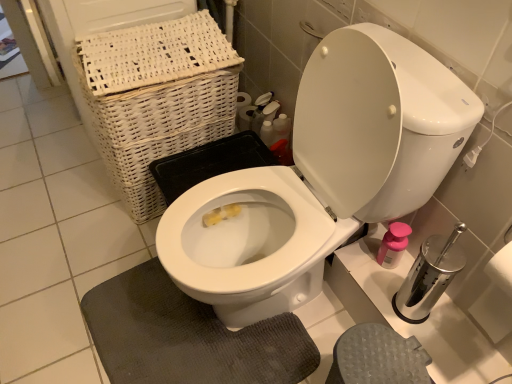
In order to face white wicker basket at upper left, should I rotate leftwards or rightwards?

You should look left and rotate roughly 12.417 degrees.

Describe the element at coordinates (496, 296) in the screenshot. This screenshot has width=512, height=384. I see `silver metallic toilet paper at right` at that location.

I want to click on white glossy toilet at center, so click(322, 176).

From a real-world perspective, between pink plastic soap dispenser at right and gray textured bath mat at lower center, who is vertically higher?

pink plastic soap dispenser at right, from a real-world perspective.

Considering the positions of objects pink plastic soap dispenser at right and gray textured bath mat at lower center in the image provided, who is more to the right, pink plastic soap dispenser at right or gray textured bath mat at lower center?

Positioned to the right is pink plastic soap dispenser at right.

Could you tell me if pink plastic soap dispenser at right is facing gray textured bath mat at lower center?

Yes, pink plastic soap dispenser at right is oriented towards gray textured bath mat at lower center.

Which point is more distant from viewer, (379, 252) or (117, 346)?

The point (379, 252) is farther.

Is white wicker basket at upper left aimed at pink plastic soap dispenser at right?

No.

Which is in front, white wicker basket at upper left or pink plastic soap dispenser at right?

white wicker basket at upper left is more forward.

Does point (108, 93) appear closer or farther from the camera than point (387, 255)?

Point (108, 93) appears to be closer to the viewer than point (387, 255).

Can you confirm if white wicker basket at upper left is positioned to the left of pink plastic soap dispenser at right?

Yes, white wicker basket at upper left is to the left of pink plastic soap dispenser at right.

Based on the photo, which is less distant, (240, 265) or (383, 253)?

Point (240, 265) is positioned closer to the camera compared to point (383, 253).

Is the depth of white glossy toilet at center less than that of pink plastic soap dispenser at right?

Yes, it is.

Would you say white glossy toilet at center is a long distance from pink plastic soap dispenser at right?

They are positioned close to each other.

Identify the location of toiletry that appears on the right of white glossy toilet at center. Image resolution: width=512 pixels, height=384 pixels. (393, 245).

From the image's perspective, which is above, pink plastic soap dispenser at right or white glossy toilet at center?

white glossy toilet at center appears higher in the image.

Is silver metallic toilet paper at right situated inside white glossy toilet at center or outside?

silver metallic toilet paper at right exists outside the volume of white glossy toilet at center.

Could you tell me if silver metallic toilet paper at right is turned towards white glossy toilet at center?

No, silver metallic toilet paper at right does not turn towards white glossy toilet at center.

Considering the relative positions of silver metallic toilet paper at right and white glossy toilet at center in the image provided, is silver metallic toilet paper at right to the left of white glossy toilet at center from the viewer's perspective?

In fact, silver metallic toilet paper at right is to the right of white glossy toilet at center.

Considering the points (487, 332) and (344, 215), which point is behind, point (487, 332) or point (344, 215)?

The point (344, 215) is farther.

Are pink plastic soap dispenser at right and white wicker basket at upper left far apart?

Actually, pink plastic soap dispenser at right and white wicker basket at upper left are a little close together.

Does pink plastic soap dispenser at right come in front of white wicker basket at upper left?

No, it is behind white wicker basket at upper left.

I want to click on basket that is above the pink plastic soap dispenser at right (from a real-world perspective), so click(157, 98).

How much distance is there between silver metallic toilet paper at right and gray textured bath mat at lower center?

silver metallic toilet paper at right is 28.86 inches away from gray textured bath mat at lower center.

Can you tell me how much silver metallic toilet paper at right and gray textured bath mat at lower center differ in facing direction?

The angle between the facing direction of silver metallic toilet paper at right and the facing direction of gray textured bath mat at lower center is 0.287 degrees.

Identify the location of toilet paper on the right of gray textured bath mat at lower center. (496, 296).

Considering the relative positions of silver metallic toilet paper at right and gray textured bath mat at lower center in the image provided, is silver metallic toilet paper at right behind gray textured bath mat at lower center?

No, silver metallic toilet paper at right is closer to the camera.

Image resolution: width=512 pixels, height=384 pixels. What are the coordinates of `toiletry behind the gray textured bath mat at lower center` in the screenshot? It's located at (393, 245).

The image size is (512, 384). Find the location of `toiletry below the white wicker basket at upper left (from the image's perspective)`. toiletry below the white wicker basket at upper left (from the image's perspective) is located at coordinates (393, 245).

Considering their positions, is pink plastic soap dispenser at right positioned further to silver metallic toilet paper at right than white wicker basket at upper left?

The object further to silver metallic toilet paper at right is white wicker basket at upper left.

Estimate the real-world distances between objects in this image. Which object is further from gray textured bath mat at lower center, white wicker basket at upper left or white glossy toilet at center?

white wicker basket at upper left.

From the image, which object appears to be farther from pink plastic soap dispenser at right, white wicker basket at upper left or gray textured bath mat at lower center?

Among the two, white wicker basket at upper left is located further to pink plastic soap dispenser at right.

Looking at the image, which one is located further to pink plastic soap dispenser at right, white glossy toilet at center or silver metallic toilet paper at right?

white glossy toilet at center.

Looking at the image, which one is located further to pink plastic soap dispenser at right, silver metallic toilet paper at right or white glossy toilet at center?

The object further to pink plastic soap dispenser at right is white glossy toilet at center.

Looking at the image, which one is located further to gray textured bath mat at lower center, silver metallic toilet paper at right or pink plastic soap dispenser at right?

A: silver metallic toilet paper at right is further to gray textured bath mat at lower center.

Looking at the image, which one is located closer to white wicker basket at upper left, white glossy toilet at center or gray textured bath mat at lower center?

white glossy toilet at center is positioned closer to the anchor white wicker basket at upper left.

In the scene shown: Estimate the real-world distances between objects in this image. Which object is further from gray textured bath mat at lower center, white glossy toilet at center or silver metallic toilet paper at right?

silver metallic toilet paper at right is further to gray textured bath mat at lower center.

At what (x,y) coordinates should I click in order to perform the action: click on bath mat located between white wicker basket at upper left and silver metallic toilet paper at right in the left-right direction. Please return your answer as a coordinate pair (x, y). This screenshot has width=512, height=384. Looking at the image, I should click on (188, 336).

Image resolution: width=512 pixels, height=384 pixels. In order to click on toilet paper between white glossy toilet at center and pink plastic soap dispenser at right in the front-back direction in this screenshot , I will do `click(496, 296)`.

Where is `bath mat between white glossy toilet at center and pink plastic soap dispenser at right in the front-back direction`? bath mat between white glossy toilet at center and pink plastic soap dispenser at right in the front-back direction is located at coordinates (188, 336).

Locate an element on the screen. The width and height of the screenshot is (512, 384). toilet situated between white wicker basket at upper left and pink plastic soap dispenser at right from left to right is located at coordinates (322, 176).